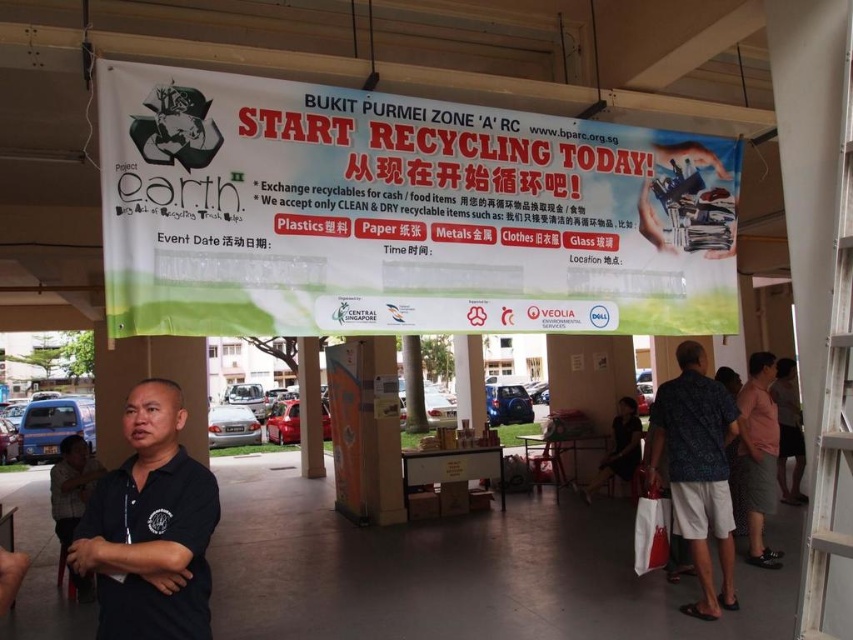
Question: Is white paper banner at upper center smaller than pink cotton shirt at right?

Choices:
 (A) yes
 (B) no

Answer: (B)

Question: Among these objects, which one is nearest to the camera?

Choices:
 (A) dark gray fabric shirt at center
 (B) pink cotton shirt at right

Answer: (B)

Question: Which point is farther to the camera?

Choices:
 (A) (633, 401)
 (B) (177, 484)

Answer: (A)

Question: Does pink cotton shirt at right have a smaller size compared to dark gray shirt at lower left?

Choices:
 (A) yes
 (B) no

Answer: (B)

Question: Which object appears closest to the camera in this image?

Choices:
 (A) printed fabric shirt at right
 (B) white paper banner at upper center
 (C) dark gray shirt at lower left
 (D) pink fabric at right

Answer: (B)

Question: Does white paper banner at upper center lie behind dark gray fabric shirt at center?

Choices:
 (A) no
 (B) yes

Answer: (A)